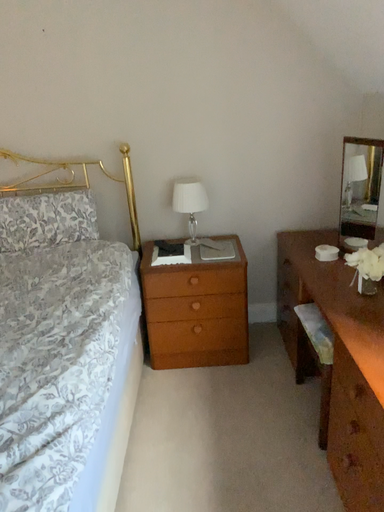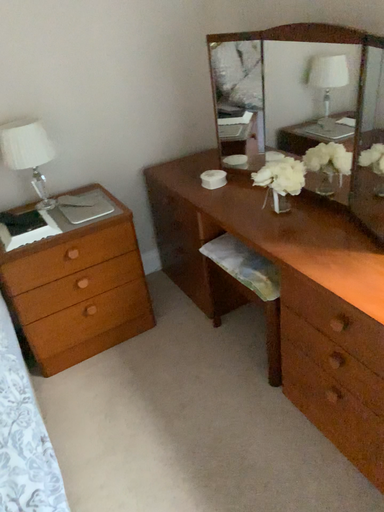
Question: Which way did the camera rotate in the video?

Choices:
 (A) rotated left
 (B) rotated right

Answer: (B)